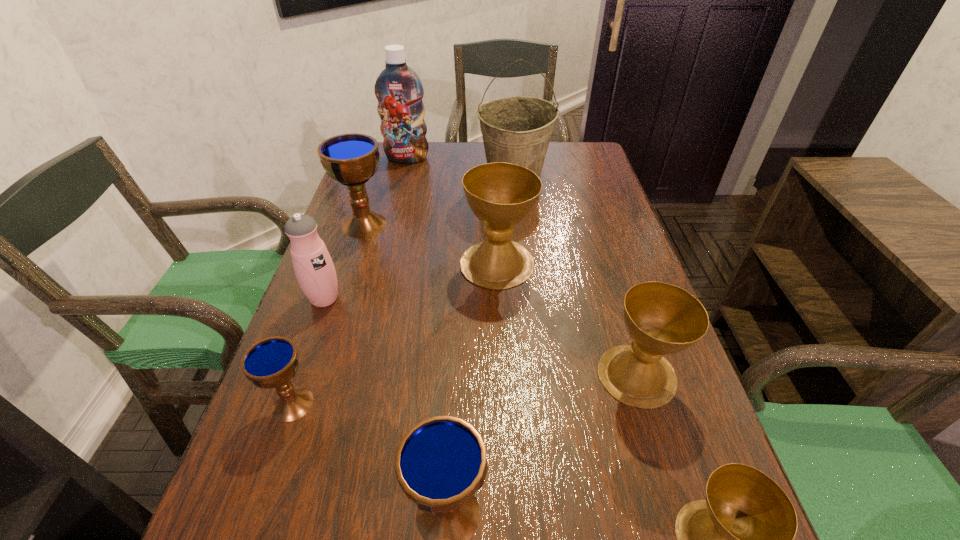
Select which object is the second closest to the leftmost brown chalice. Please provide its 2D coordinates. Your answer should be formatted as a tuple, i.e. [(x, y)], where the tuple contains the x and y coordinates of a point satisfying the conditions above.

[(352, 159)]

This screenshot has height=540, width=960. In order to click on chalice that is the fifth closest to the nearest brown chalice in this screenshot , I will do `click(352, 159)`.

Locate which chalice ranks third in proximity to the wine bucket. Please provide its 2D coordinates. Your answer should be formatted as a tuple, i.e. [(x, y)], where the tuple contains the x and y coordinates of a point satisfying the conditions above.

[(662, 319)]

In order to click on brown chalice identified as the third closest to the thermos bottle in this screenshot , I will do [740, 539].

I want to click on brown chalice object that ranks as the second closest to the nearest brown chalice, so click(501, 195).

Identify which blue chalice is the second closest to the second biggest brown chalice. Please provide its 2D coordinates. Your answer should be formatted as a tuple, i.e. [(x, y)], where the tuple contains the x and y coordinates of a point satisfying the conditions above.

[(270, 363)]

Image resolution: width=960 pixels, height=540 pixels. I want to click on blue chalice identified as the second closest to the second farthest brown chalice, so click(270, 363).

Locate an element on the screen. The width and height of the screenshot is (960, 540). vacant region that satisfies the following two spatial constraints: 1. on the front side of the second smallest brown chalice; 2. on the right side of the thermos bottle is located at coordinates (298, 375).